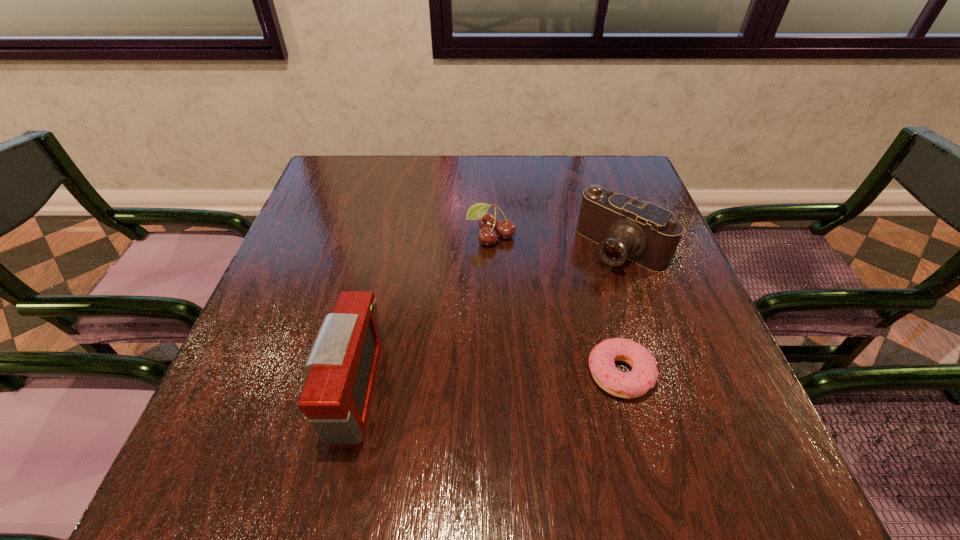
I want to click on camera that is at the right edge, so click(625, 228).

Image resolution: width=960 pixels, height=540 pixels. What are the coordinates of `object at the near right corner` in the screenshot? It's located at (643, 376).

I want to click on vacant region at the far edge, so click(439, 189).

Image resolution: width=960 pixels, height=540 pixels. In the image, there is a desktop. What are the coordinates of `vacant space at the left edge` in the screenshot? It's located at (255, 346).

Locate an element on the screen. This screenshot has width=960, height=540. vacant space at the far left corner of the desktop is located at coordinates (329, 199).

You are a GUI agent. You are given a task and a screenshot of the screen. Output one action in this format:
    pyautogui.click(x=<x>, y=<y>)
    Task: Click on the free space at the near left corner of the desktop
    
    Given the screenshot: What is the action you would take?
    [223, 416]

Identify the location of vacant area at the near right corner. (738, 412).

Where is `free space between the third object from right to left and the right camera`? This screenshot has width=960, height=540. free space between the third object from right to left and the right camera is located at coordinates (557, 242).

This screenshot has width=960, height=540. Find the location of `free area in between the shortest object and the shorter camera`. free area in between the shortest object and the shorter camera is located at coordinates (621, 312).

Locate an element on the screen. free point between the right camera and the second shortest object is located at coordinates (557, 242).